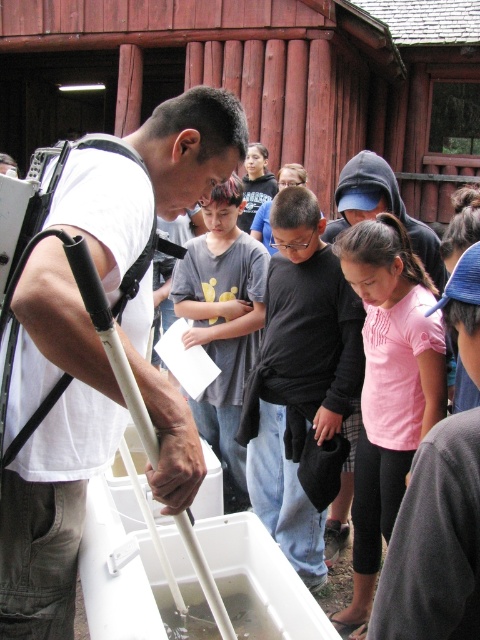
Can you confirm if white matte crutch at left is positioned to the right of gray cotton shirt at center?

In fact, white matte crutch at left is to the left of gray cotton shirt at center.

Is the position of white matte crutch at left more distant than that of gray cotton shirt at center?

No, white matte crutch at left is in front of gray cotton shirt at center.

Between point (95, 196) and point (213, 289), which one is positioned in front?

Point (95, 196) is more forward.

The image size is (480, 640). What are the coordinates of `white matte crutch at left` in the screenshot? It's located at (51, 449).

Is black matte shirt at center below pink cotton shirt at center?

No, black matte shirt at center is not below pink cotton shirt at center.

You are a GUI agent. You are given a task and a screenshot of the screen. Output one action in this format:
    pyautogui.click(x=<x>, y=<y>)
    Task: Click on the black matte shirt at center
    
    Given the screenshot: What is the action you would take?
    pyautogui.click(x=299, y=376)

Identify the location of black matte shirt at center. The height and width of the screenshot is (640, 480). point(299,376).

Does white matte crutch at left lie in front of black matte shirt at center?

Yes, it is in front of black matte shirt at center.

Can you confirm if white matte crutch at left is smaller than black matte shirt at center?

Correct, white matte crutch at left occupies less space than black matte shirt at center.

Locate an element on the screen. white matte crutch at left is located at coordinates (51, 449).